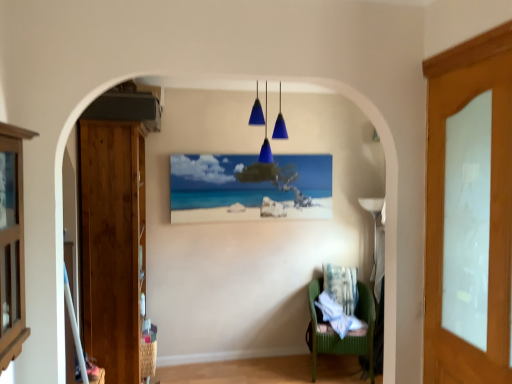
Question: Should I look upward or downward to see blue glass pendant lights at center?

Choices:
 (A) down
 (B) up

Answer: (B)

Question: Is wooden cabinet at left taller than wooden door at left, acting as the second door starting from the right?

Choices:
 (A) no
 (B) yes

Answer: (A)

Question: Can you confirm if wooden cabinet at left is thinner than wooden door at left, which is counted as the second door, starting from the front?

Choices:
 (A) no
 (B) yes

Answer: (B)

Question: Considering the relative positions of wooden cabinet at left and wooden door at left, acting as the second door starting from the right, in the image provided, is wooden cabinet at left behind wooden door at left, acting as the second door starting from the right,?

Choices:
 (A) no
 (B) yes

Answer: (A)

Question: From the image's perspective, is wooden cabinet at left on wooden door at left, which is counted as the second door, starting from the front?

Choices:
 (A) no
 (B) yes

Answer: (B)

Question: Considering the relative positions of wooden cabinet at left and wooden door at left, the 1th door from the back, in the image provided, is wooden cabinet at left to the right of wooden door at left, the 1th door from the back, from the viewer's perspective?

Choices:
 (A) yes
 (B) no

Answer: (A)

Question: Considering the relative sizes of wooden cabinet at left and wooden door at left, the 1th door from the left, in the image provided, is wooden cabinet at left wider than wooden door at left, the 1th door from the left,?

Choices:
 (A) no
 (B) yes

Answer: (A)

Question: From a real-world perspective, is green fabric chair at lower right on fluffy white pillow at lower center?

Choices:
 (A) yes
 (B) no

Answer: (B)

Question: Is green fabric chair at lower right bigger than fluffy white pillow at lower center?

Choices:
 (A) yes
 (B) no

Answer: (A)

Question: Is green fabric chair at lower right directly adjacent to fluffy white pillow at lower center?

Choices:
 (A) no
 (B) yes

Answer: (A)

Question: Is green fabric chair at lower right taller than fluffy white pillow at lower center?

Choices:
 (A) yes
 (B) no

Answer: (A)

Question: Does green fabric chair at lower right lie in front of fluffy white pillow at lower center?

Choices:
 (A) no
 (B) yes

Answer: (B)

Question: Is green fabric chair at lower right outside of fluffy white pillow at lower center?

Choices:
 (A) no
 (B) yes

Answer: (B)

Question: Is matte wooden picture frame at center at the back of wooden cabinet at left?

Choices:
 (A) no
 (B) yes

Answer: (A)